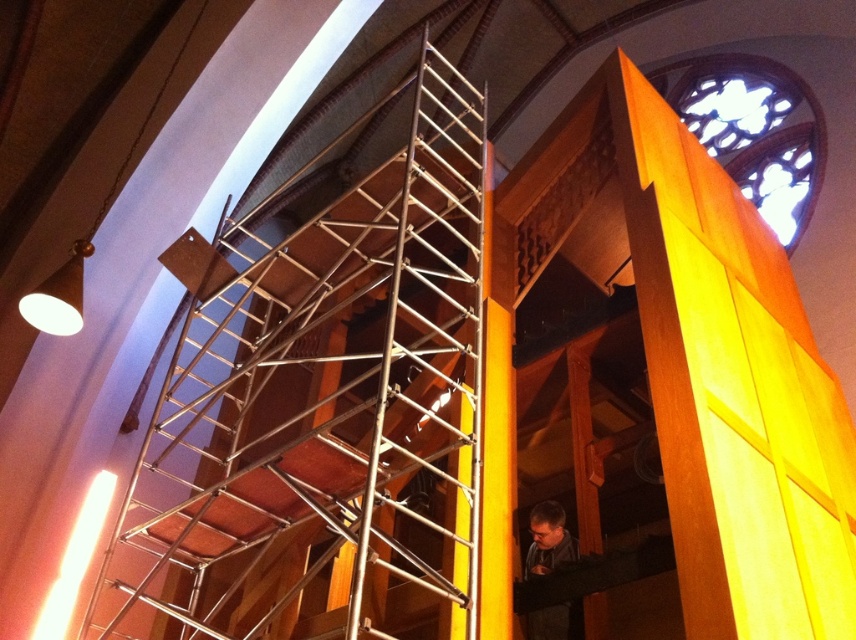
Question: Which point is farther from the camera taking this photo?

Choices:
 (A) (242, 566)
 (B) (539, 508)

Answer: (A)

Question: Does metallic scaffolding at center have a larger size compared to dark gray fabric at lower right?

Choices:
 (A) yes
 (B) no

Answer: (A)

Question: Which object is closer to the camera taking this photo?

Choices:
 (A) metallic scaffolding at center
 (B) dark gray fabric at lower right

Answer: (A)

Question: Among these points, which one is nearest to the camera?

Choices:
 (A) (449, 256)
 (B) (551, 518)

Answer: (B)

Question: Does metallic scaffolding at center appear over dark gray fabric at lower right?

Choices:
 (A) yes
 (B) no

Answer: (A)

Question: Can you confirm if metallic scaffolding at center is wider than dark gray fabric at lower right?

Choices:
 (A) yes
 (B) no

Answer: (A)